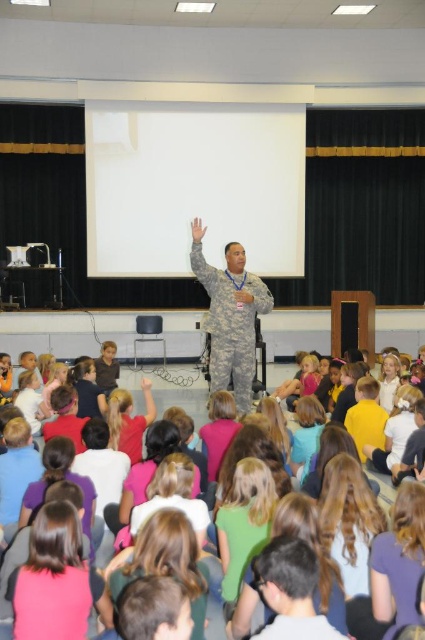
At what (x,y) coordinates should I click in order to perform the action: click on pink fabric hair at lower left. Please return your answer as a coordinate pair (x, y). Looking at the image, I should click on (51, 579).

Is pink fabric hair at lower left taller than camouflage uniform at center?

Incorrect, pink fabric hair at lower left's height is not larger of camouflage uniform at center's.

Is point (25, 632) closer to camera compared to point (201, 273)?

Yes.

You are a GUI agent. You are given a task and a screenshot of the screen. Output one action in this format:
    pyautogui.click(x=<x>, y=<y>)
    Task: Click on the pink fabric hair at lower left
    
    Given the screenshot: What is the action you would take?
    pyautogui.click(x=51, y=579)